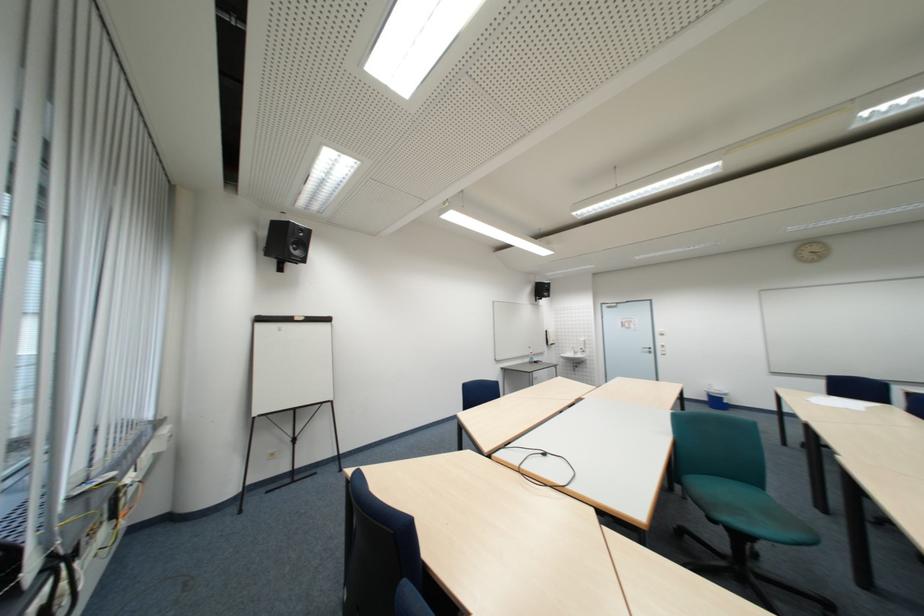
Where is `blue chair sitting surface`? This screenshot has height=616, width=924. blue chair sitting surface is located at coordinates (735, 504).